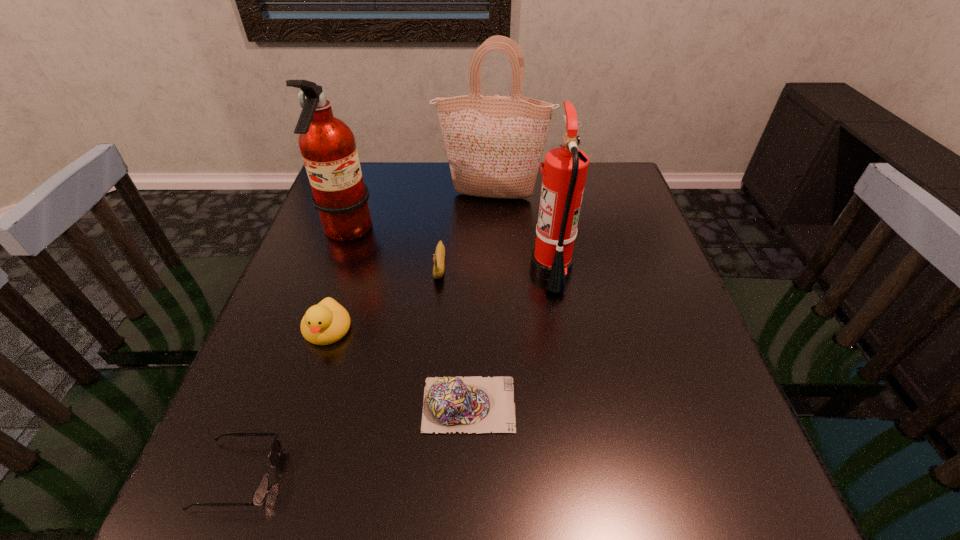
Find the location of a particular element. The image size is (960, 540). the farthest object is located at coordinates (494, 144).

Locate an element on the screen. This screenshot has width=960, height=540. the left fire extinguisher is located at coordinates 328,147.

Where is `the right fire extinguisher`? the right fire extinguisher is located at coordinates (565, 168).

The width and height of the screenshot is (960, 540). I want to click on banana, so click(x=439, y=257).

Identify the location of duckling. (327, 322).

Image resolution: width=960 pixels, height=540 pixels. Identify the location of the second shortest object. (477, 404).

At what (x,y) coordinates should I click in order to perform the action: click on cap. Please return your answer as a coordinate pair (x, y). Looking at the image, I should click on (477, 404).

This screenshot has width=960, height=540. In order to click on sunglasses in this screenshot , I will do `click(262, 489)`.

This screenshot has height=540, width=960. I want to click on the shortest object, so [x=262, y=489].

Identify the location of vacant area situated 0.370m on the front of the shopping bag. (x=495, y=303).